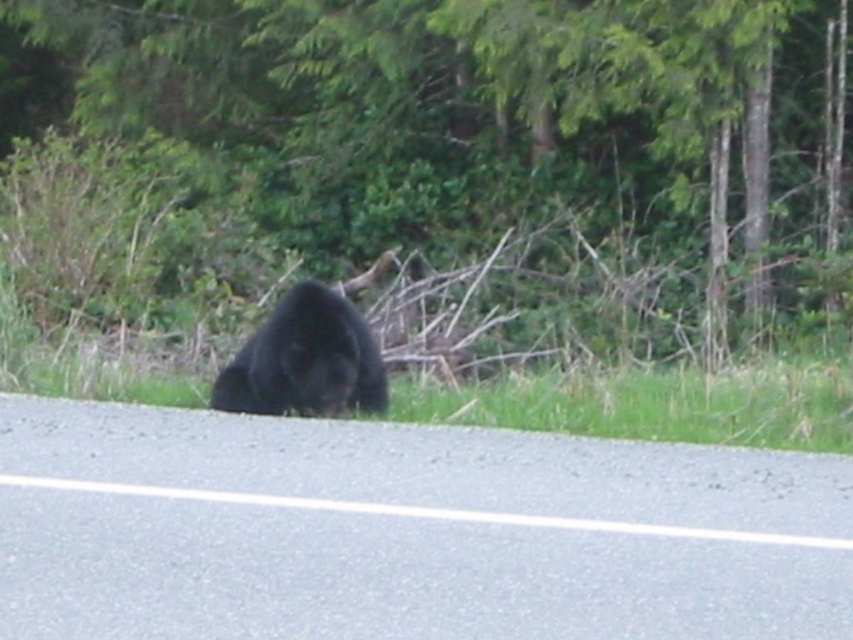
Question: Which point is closer to the camera?

Choices:
 (A) (305, 364)
 (B) (618, 259)

Answer: (A)

Question: Which point is farther to the camera?

Choices:
 (A) pyautogui.click(x=329, y=292)
 (B) pyautogui.click(x=126, y=8)

Answer: (B)

Question: Can you confirm if green leafy tree at center is positioned to the left of black fur bear at center?

Choices:
 (A) no
 (B) yes

Answer: (B)

Question: Among these objects, which one is nearest to the camera?

Choices:
 (A) green leafy tree at center
 (B) black fur bear at center

Answer: (B)

Question: Is green leafy tree at center in front of black fur bear at center?

Choices:
 (A) yes
 (B) no

Answer: (B)

Question: Is green leafy tree at center positioned before black fur bear at center?

Choices:
 (A) yes
 (B) no

Answer: (B)